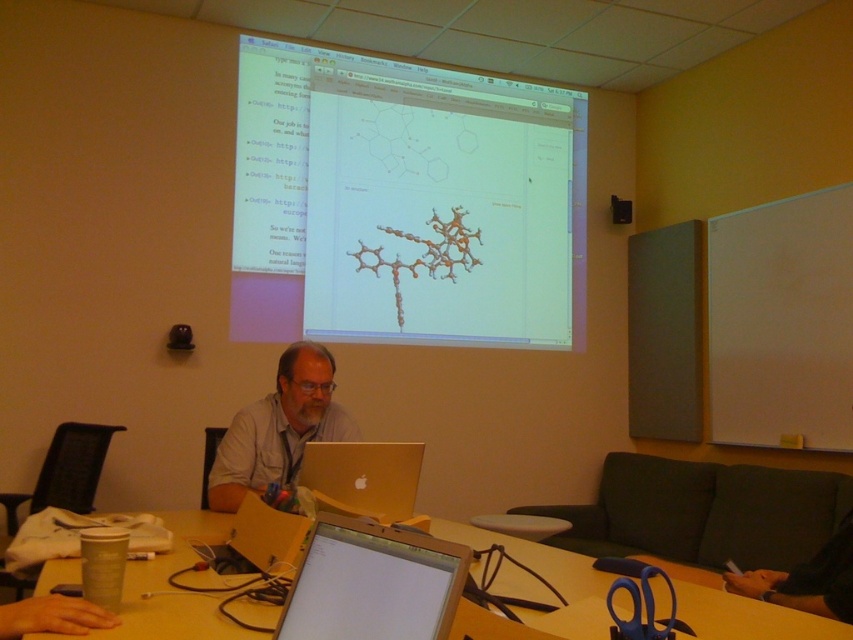
Between point (352, 170) and point (154, 576), which one is positioned in front?

Point (154, 576) is in front.

The width and height of the screenshot is (853, 640). What do you see at coordinates (407, 202) in the screenshot? I see `translucent plastic screen at upper center` at bounding box center [407, 202].

Image resolution: width=853 pixels, height=640 pixels. I want to click on translucent plastic screen at upper center, so click(407, 202).

Which of these two, matte silver tablet at center or gold metallic laptop at center, stands shorter?

With less height is matte silver tablet at center.

Between matte silver tablet at center and gold metallic laptop at center, which one is positioned lower?

Positioned lower is gold metallic laptop at center.

Between point (357, 584) and point (398, 500), which one is positioned in front?

Point (357, 584)

Where is `matte silver tablet at center`? matte silver tablet at center is located at coordinates (372, 582).

Consider the image. Is translucent plastic screen at upper center to the right of matte silver tablet at center from the viewer's perspective?

Yes, translucent plastic screen at upper center is to the right of matte silver tablet at center.

Between point (540, 298) and point (389, 608), which one is positioned behind?

The point (540, 298) is behind.

Which is behind, point (495, 131) or point (363, 563)?

Point (495, 131)

Identify the location of translucent plastic screen at upper center. This screenshot has height=640, width=853. (407, 202).